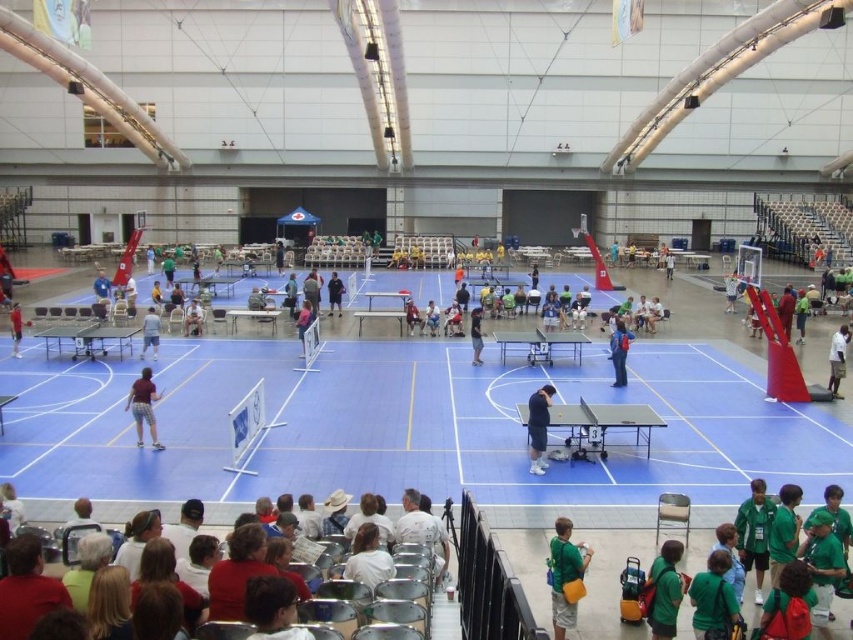
Can you confirm if matte black shirt at center is positioned above red shirt at center?

Yes.

Can you confirm if matte black shirt at center is positioned to the left of red shirt at center?

In fact, matte black shirt at center is to the right of red shirt at center.

Is point (334, 280) closer to viewer compared to point (10, 308)?

No, (334, 280) is behind (10, 308).

I want to click on matte black shirt at center, so (334, 292).

Can you confirm if matte brown shorts at center is positioned to the right of white matte shirt at center?

Incorrect, matte brown shorts at center is not on the right side of white matte shirt at center.

Which of these two, matte brown shorts at center or white matte shirt at center, stands shorter?

With less height is matte brown shorts at center.

The height and width of the screenshot is (640, 853). In order to click on matte brown shorts at center in this screenshot , I will do `click(143, 406)`.

Describe the element at coordinates (128, 509) in the screenshot. This screenshot has height=640, width=853. I see `white fabric chairs at lower center` at that location.

Based on the photo, is white fabric chairs at lower center positioned in front of dark blue fabric at center?

That is True.

Does point (122, 528) come farther from viewer compared to point (544, 438)?

No, it is in front of (544, 438).

Locate an element on the screen. The image size is (853, 640). white fabric chairs at lower center is located at coordinates (128, 509).